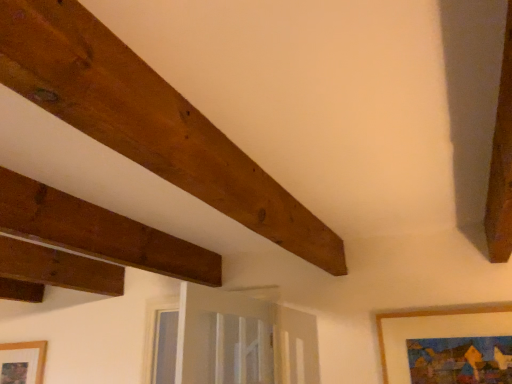
Question: Is wooden picture frame at lower left, which is the 2th picture frame in front-to-back order, spatially inside brown wooden plank at upper left, or outside of it?

Choices:
 (A) outside
 (B) inside

Answer: (A)

Question: Is point (10, 382) closer or farther from the camera than point (198, 110)?

Choices:
 (A) farther
 (B) closer

Answer: (A)

Question: Considering the real-world distances, which object is farthest from the wooden framed painting at lower right, the 1th picture frame viewed from the top?

Choices:
 (A) brown wooden plank at upper left
 (B) wooden picture frame at lower left, the second picture frame when ordered from right to left

Answer: (B)

Question: Which of these objects is positioned closest to the wooden picture frame at lower left, arranged as the 1th picture frame when viewed from the back?

Choices:
 (A) wooden framed painting at lower right, marked as the first picture frame in a front-to-back arrangement
 (B) brown wooden plank at upper left

Answer: (B)